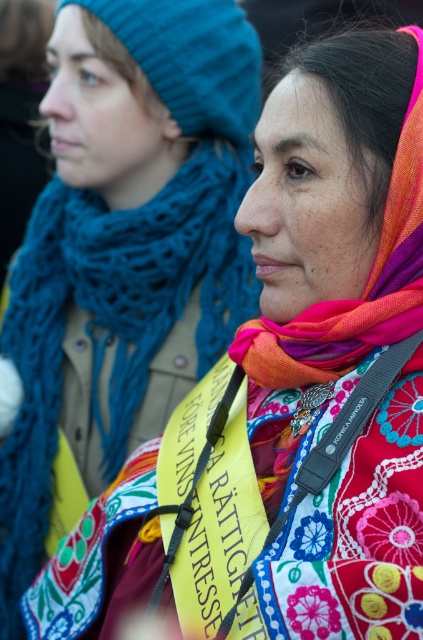
Looking at this image, between multicolored woven scarf at center and knitted blue scarf at left, which one is positioned lower?

Positioned lower is knitted blue scarf at left.

Does point (370, 237) come closer to viewer compared to point (32, 490)?

Yes, it is in front of point (32, 490).

Where is `multicolored woven scarf at center`? The width and height of the screenshot is (423, 640). multicolored woven scarf at center is located at coordinates (343, 224).